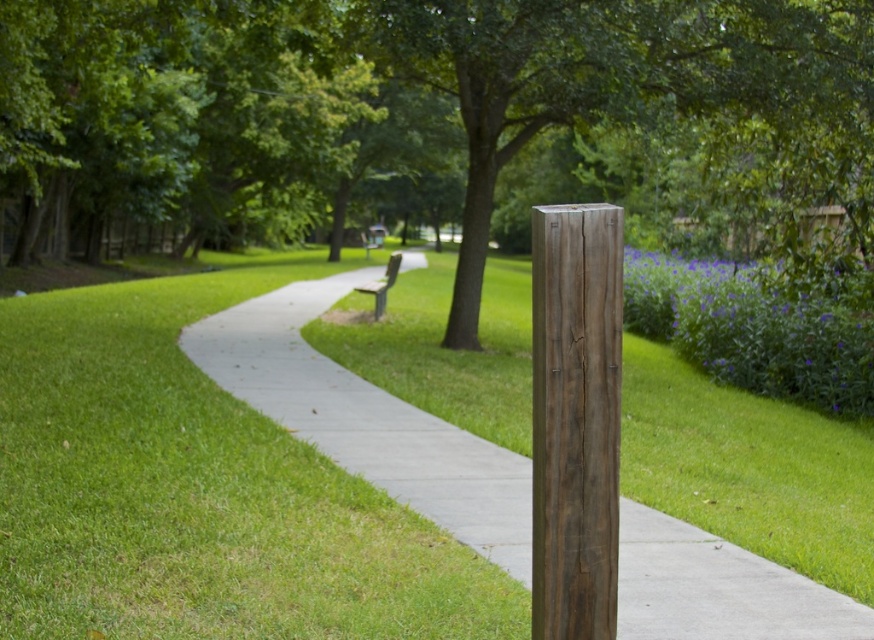
You are planning to hang a small birdhouse on the weathered wood post at center and the wooden bench at center. Which object would be more suitable for hanging the birdhouse based on their heights?

The wooden bench at center is taller than the weathered wood post at center, so it would be more suitable for hanging the birdhouse.

You are a gardener who needs to place a new flower pot between the gray concrete pavement at center and the wooden bench at center. According to the scene, which object should the flower pot be placed closer to?

The flower pot should be placed closer to the wooden bench at center because the gray concrete pavement at center is to the right of the wooden bench at center, meaning the bench is on the left side. Therefore, placing the flower pot between them would require it to be closer to the bench to maintain the leftward curve of the path.

You are standing at the entrance of the park and want to walk towards the gray concrete pavement at center. Which direction should you head?

The gray concrete pavement at center is located at point (366, 419) in the image, so you should head towards the center of the image to reach it.